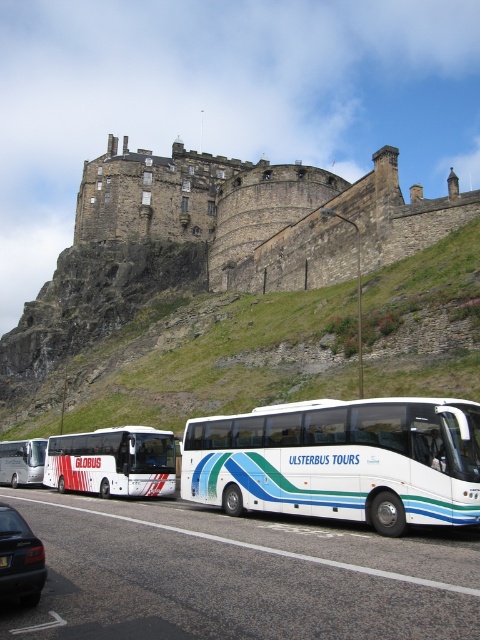
Who is shorter, white glossy bus at left or black plastic license plate at lower center?

black plastic license plate at lower center

Does white glossy bus at left come behind black plastic license plate at lower center?

Yes, it is behind black plastic license plate at lower center.

This screenshot has height=640, width=480. What do you see at coordinates (22, 461) in the screenshot? I see `white glossy bus at left` at bounding box center [22, 461].

Identify the location of white glossy bus at left. This screenshot has height=640, width=480. (22, 461).

I want to click on shiny black sedan at lower left, so click(20, 557).

Does point (40, 563) come farther from viewer compared to point (0, 476)?

No, it is not.

Which is in front, point (23, 600) or point (22, 465)?

Point (23, 600) is more forward.

This screenshot has width=480, height=640. What are the coordinates of `shiny black sedan at lower left` in the screenshot? It's located at (20, 557).

In the scene shown: Between white glossy bus at lower center and shiny black sedan at lower left, which one is positioned higher?

white glossy bus at lower center

Can you confirm if white glossy bus at lower center is thinner than shiny black sedan at lower left?

No.

Who is more forward, (347, 506) or (26, 545)?

Point (26, 545) is in front.

At what (x,y) coordinates should I click in order to perform the action: click on white glossy bus at lower center. Please return your answer as a coordinate pair (x, y). Looking at the image, I should click on coord(340,460).